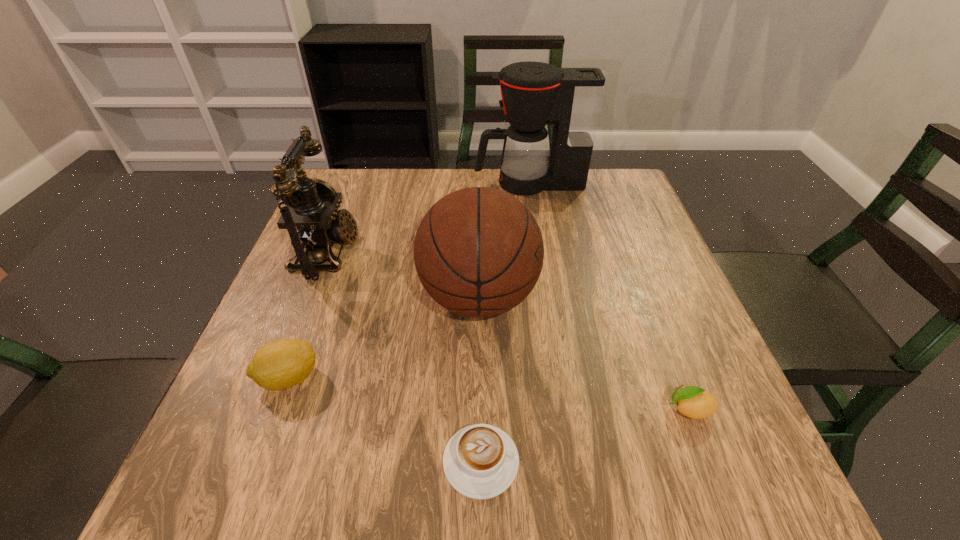
Locate an element on the screen. The image size is (960, 540). vacant space at the far right corner is located at coordinates (612, 191).

The image size is (960, 540). Find the location of `vacant area at the near right corner of the desktop`. vacant area at the near right corner of the desktop is located at coordinates (673, 492).

Identify the location of vacant space that's between the rightmost object and the fourth tallest object. (489, 394).

This screenshot has height=540, width=960. I want to click on free space between the telephone and the left lemon, so click(x=308, y=315).

Find the location of a particular element. vacant space that's between the taller lemon and the farthest object is located at coordinates (409, 280).

Locate an element on the screen. Image resolution: width=960 pixels, height=540 pixels. free spot between the telephone and the left lemon is located at coordinates (308, 315).

Where is `unoccupied position between the shorter lemon and the farthest object`? Image resolution: width=960 pixels, height=540 pixels. unoccupied position between the shorter lemon and the farthest object is located at coordinates (609, 296).

The width and height of the screenshot is (960, 540). I want to click on free space between the shorter lemon and the telephone, so click(x=508, y=331).

Identify the location of vacant region between the taller lemon and the basketball. (384, 338).

You are a GUI agent. You are given a task and a screenshot of the screen. Output one action in this format:
    pyautogui.click(x=<x>, y=<y>)
    Task: Click on the vacant space in between the telephone and the right lemon
    This screenshot has height=540, width=960.
    Given the screenshot: What is the action you would take?
    pyautogui.click(x=508, y=331)